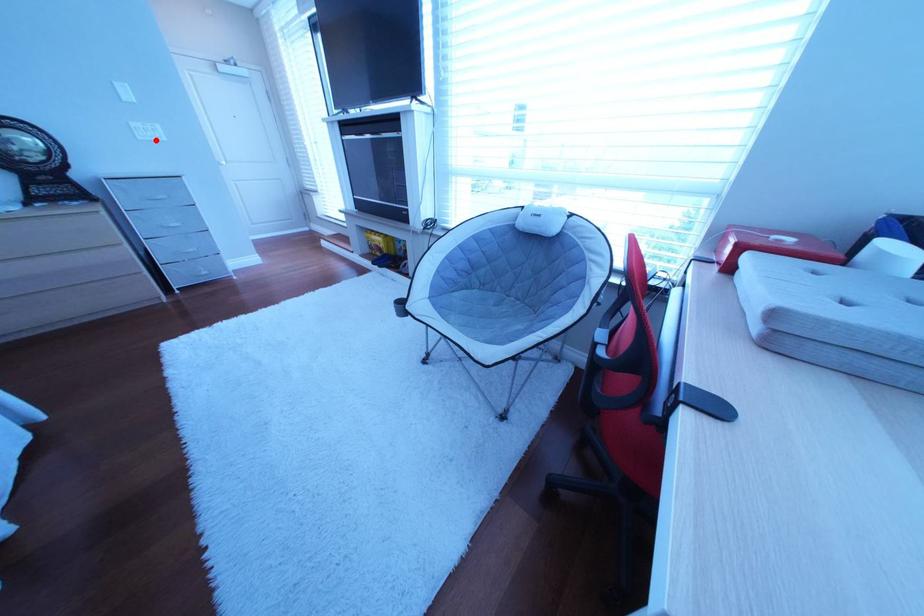
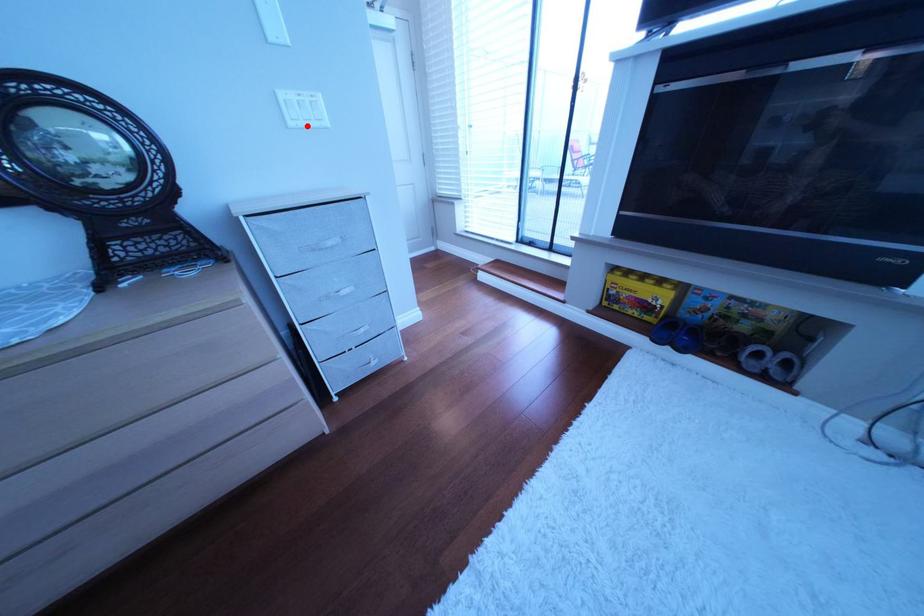
I am providing you with two images of the same scene from different viewpoints. A red point is marked on the first image and another point is marked on the second image. Is the red point in image1 aligned with the point shown in image2?

Yes